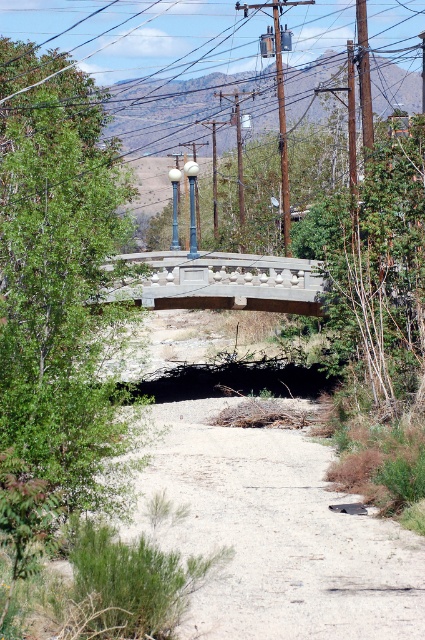
Is gray concrete bridge at center positioned at the back of polished metal lamp post at center?

No, gray concrete bridge at center is closer to the viewer.

In the scene shown: Who is more forward, (104, 288) or (190, 252)?

Positioned in front is point (104, 288).

Locate an element on the screen. The height and width of the screenshot is (640, 425). gray concrete bridge at center is located at coordinates (215, 282).

Between brown wooden telegraph pole at upper center and matte gray pole at center, which one appears on the right side from the viewer's perspective?

brown wooden telegraph pole at upper center

Is brown wooden telegraph pole at upper center above matte gray pole at center?

Indeed, brown wooden telegraph pole at upper center is positioned over matte gray pole at center.

What are the coordinates of `brown wooden telegraph pole at upper center` in the screenshot? It's located at (280, 109).

Does brown wooden telegraph pole at upper center appear on the right side of polished metal lamp post at center?

Indeed, brown wooden telegraph pole at upper center is positioned on the right side of polished metal lamp post at center.

Is brown wooden telegraph pole at upper center to the left of polished metal lamp post at center from the viewer's perspective?

In fact, brown wooden telegraph pole at upper center is to the right of polished metal lamp post at center.

I want to click on brown wooden telegraph pole at upper center, so click(280, 109).

Locate an element on the screen. brown wooden telegraph pole at upper center is located at coordinates (280, 109).